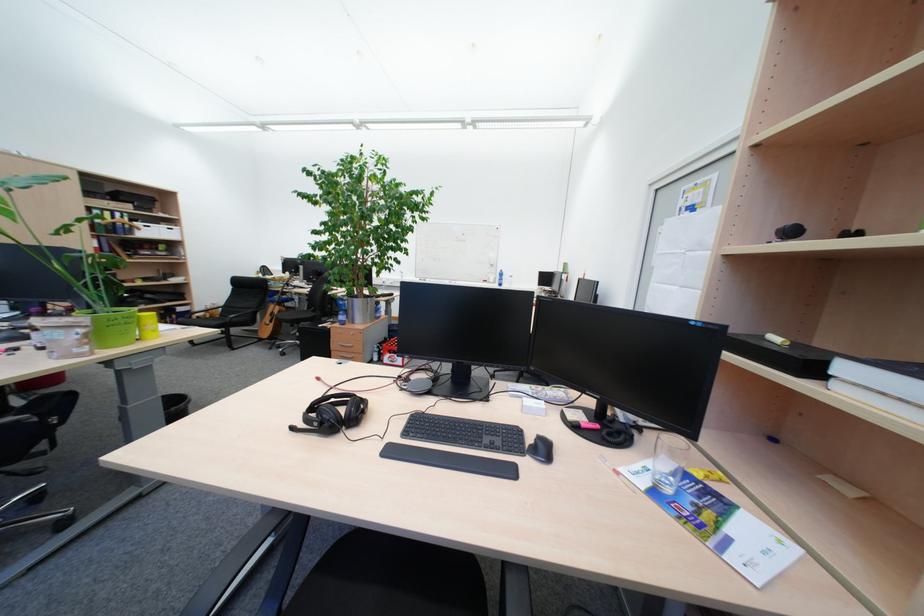
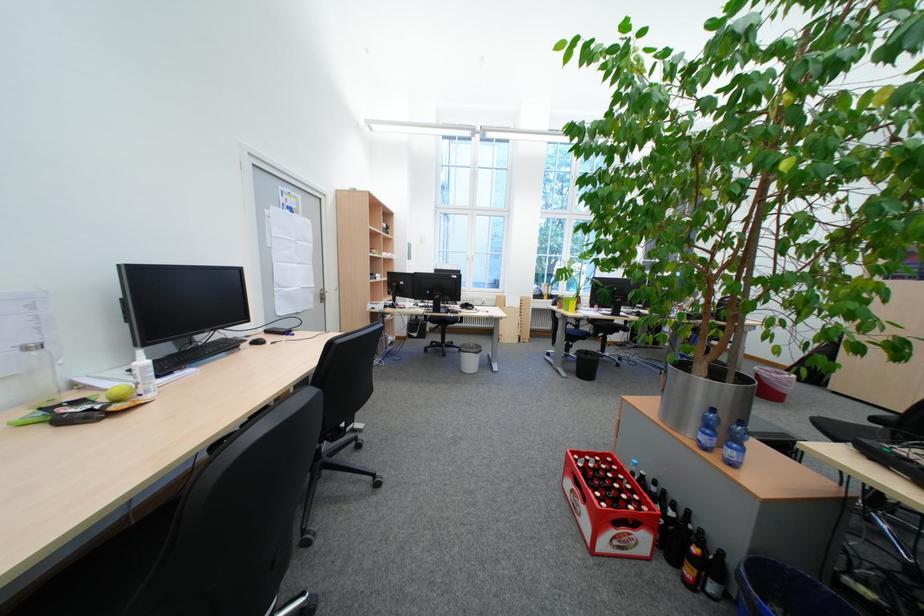
Question: I am providing you with two images of the same scene from different viewpoints. Please identify which objects are invisible in image2.

Choices:
 (A) snow globe
 (B) black headphone set
 (C) red beverage crate
 (D) white spray bottle

Answer: (B)